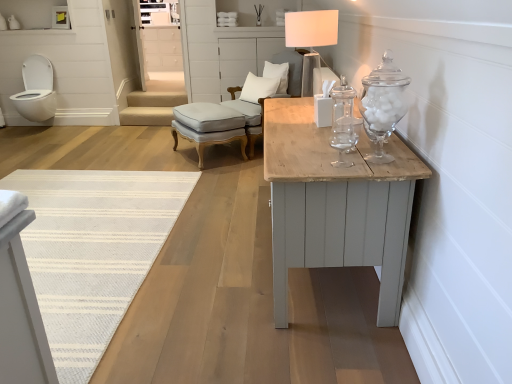
Find the location of a particular element. vacant space underneath light gray fabric stool at center (from a real-world perspective) is located at coordinates (219, 154).